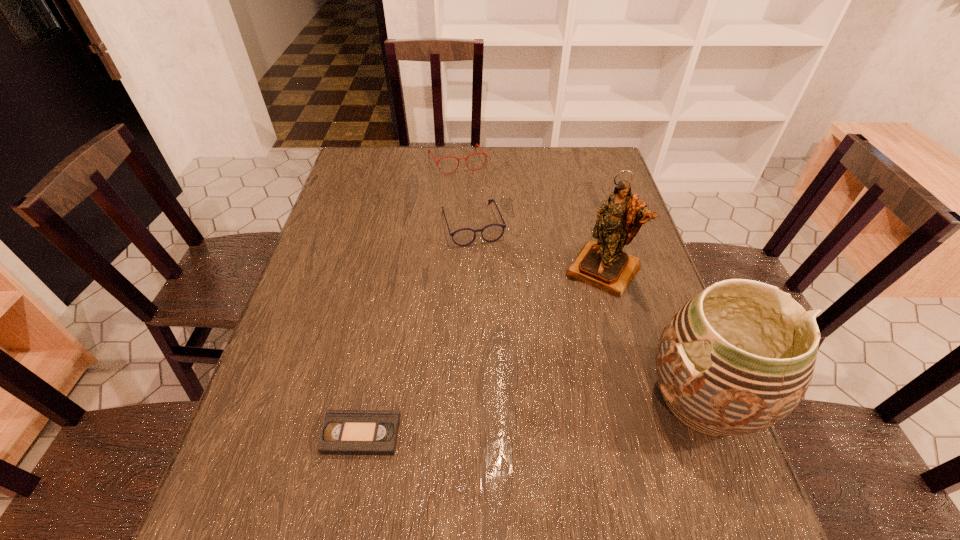
This screenshot has height=540, width=960. I want to click on free space on the desktop that is between the shortest object and the pottery and is positioned on the front-facing side of the figurine, so click(497, 420).

The height and width of the screenshot is (540, 960). I want to click on vacant space on the desktop that is between the shortest object and the pottery and is positioned on the face of the farthest object, so click(x=567, y=413).

This screenshot has width=960, height=540. Find the location of `free spot on the desktop that is between the videotape and the pottery and is positioned on the front-facing side of the nearer spectacles`. free spot on the desktop that is between the videotape and the pottery and is positioned on the front-facing side of the nearer spectacles is located at coordinates (540, 416).